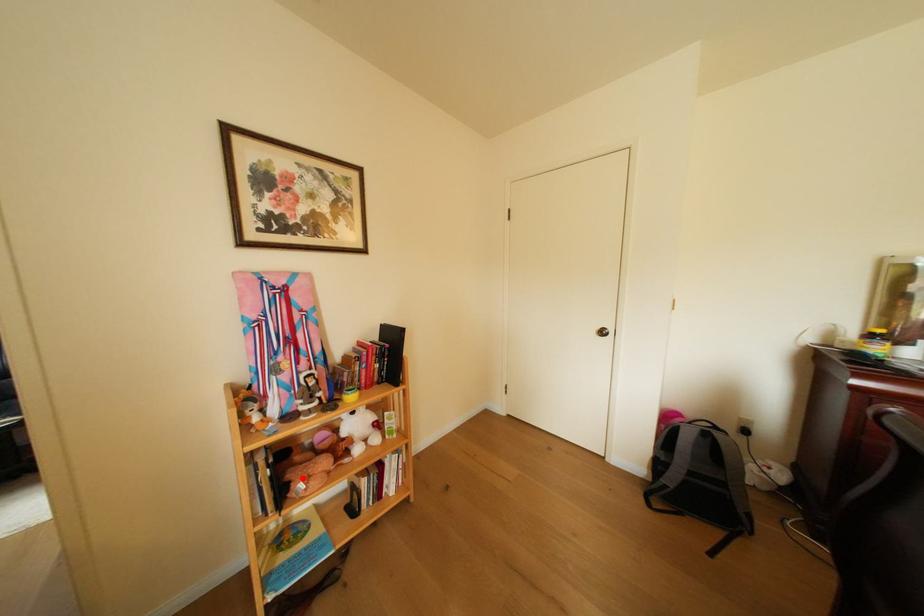
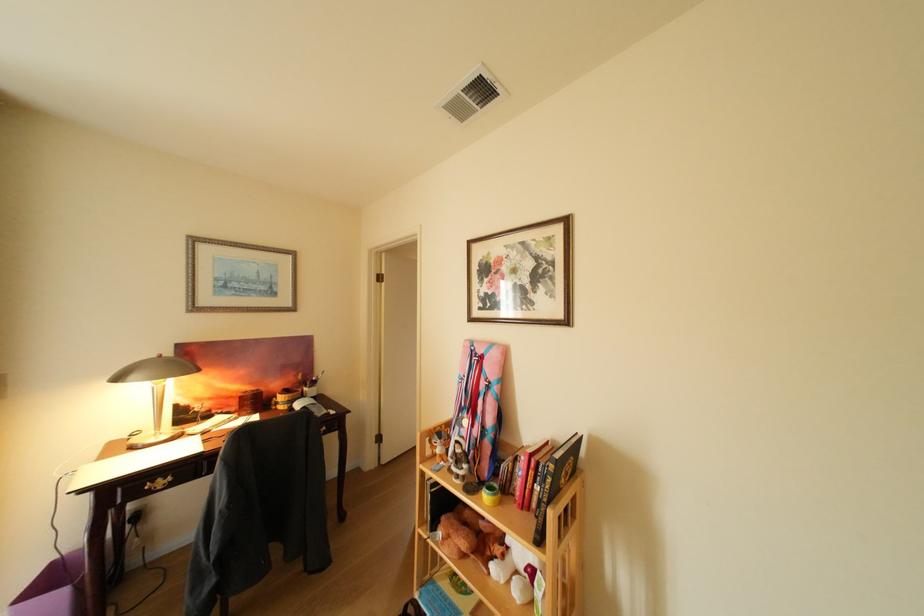
Where in the second image is the point corresponding to the highlighted location from the first image?

(456, 519)